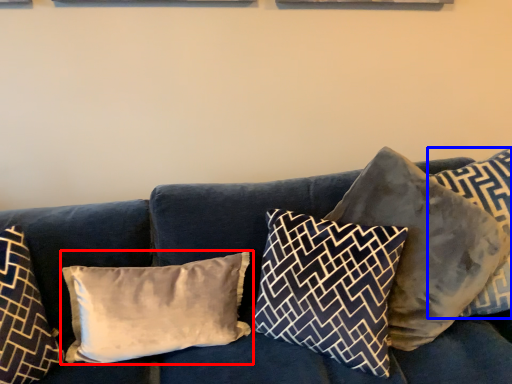
Question: Which point is closer to the camera, pillow (highlighted by a red box) or pillow (highlighted by a blue box)?

Choices:
 (A) pillow
 (B) pillow

Answer: (B)